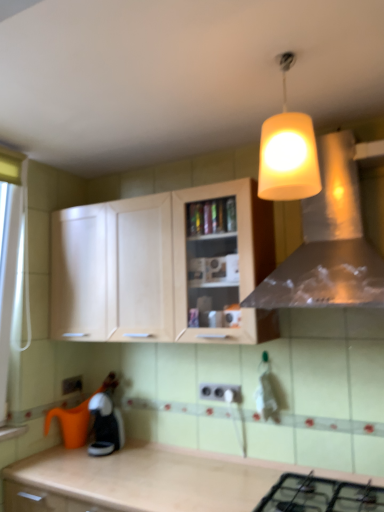
Question: Considering the relative positions of yellow matte lampshade at upper center and metallic silver vent at upper center in the image provided, is yellow matte lampshade at upper center to the left of metallic silver vent at upper center from the viewer's perspective?

Choices:
 (A) no
 (B) yes

Answer: (B)

Question: Would you say yellow matte lampshade at upper center is a long distance from metallic silver vent at upper center?

Choices:
 (A) no
 (B) yes

Answer: (A)

Question: Does yellow matte lampshade at upper center have a lesser width compared to metallic silver vent at upper center?

Choices:
 (A) no
 (B) yes

Answer: (B)

Question: Does yellow matte lampshade at upper center have a larger size compared to metallic silver vent at upper center?

Choices:
 (A) no
 (B) yes

Answer: (A)

Question: Is yellow matte lampshade at upper center taller than metallic silver vent at upper center?

Choices:
 (A) yes
 (B) no

Answer: (B)

Question: Is yellow matte lampshade at upper center aimed at metallic silver vent at upper center?

Choices:
 (A) no
 (B) yes

Answer: (A)

Question: From a real-world perspective, does black matte gas stove at lower center sit lower than white plastic electric outlet at lower center, which is counted as the first electric outlet, starting from the back?

Choices:
 (A) no
 (B) yes

Answer: (B)

Question: Is white plastic electric outlet at lower center, marked as the second electric outlet in a front-to-back arrangement, located within black matte gas stove at lower center?

Choices:
 (A) yes
 (B) no

Answer: (B)

Question: Does black matte gas stove at lower center lie behind white plastic electric outlet at lower center, acting as the first electric outlet starting from the left?

Choices:
 (A) yes
 (B) no

Answer: (B)

Question: Does black matte gas stove at lower center have a larger size compared to white plastic electric outlet at lower center, acting as the first electric outlet starting from the left?

Choices:
 (A) yes
 (B) no

Answer: (A)

Question: Considering the relative positions of black matte gas stove at lower center and white plastic electric outlet at lower center, which appears as the 2th electric outlet when viewed from the right, in the image provided, is black matte gas stove at lower center in front of white plastic electric outlet at lower center, which appears as the 2th electric outlet when viewed from the right,?

Choices:
 (A) yes
 (B) no

Answer: (A)

Question: Can you confirm if black matte gas stove at lower center is thinner than white plastic electric outlet at lower center, acting as the first electric outlet starting from the left?

Choices:
 (A) yes
 (B) no

Answer: (B)

Question: From the image's perspective, is light wood cabinet at center on white plastic electric outlet at center, which appears as the second electric outlet when viewed from the back?

Choices:
 (A) yes
 (B) no

Answer: (A)